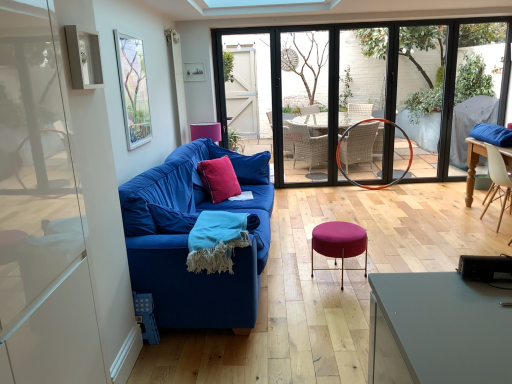
The image size is (512, 384). Identify the location of vacant area on top of matte glass window screen at upper left (from a real-world perspective). [125, 32].